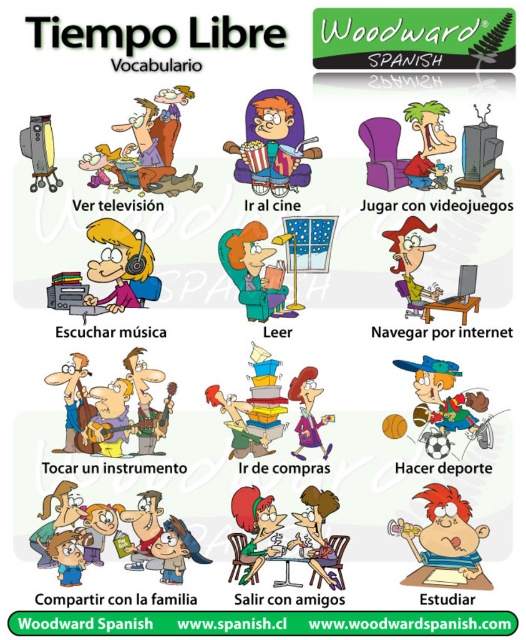
Question: Which point is farther to the camera?

Choices:
 (A) orange hair at center
 (B) matte green sweater at center
 (C) reddish-orange hair at lower right

Answer: (B)

Question: Observing the image, what is the correct spatial positioning of orange hair at center in reference to reddish-orange hair at lower right?

Choices:
 (A) left
 (B) right

Answer: (A)

Question: Does reddish-orange hair at lower right appear under matte purple dress at center?

Choices:
 (A) no
 (B) yes

Answer: (B)

Question: Is orange hair at center wider than matte green sweater at center?

Choices:
 (A) yes
 (B) no

Answer: (A)

Question: Among these objects, which one is farthest from the camera?

Choices:
 (A) matte green sweater at center
 (B) reddish-orange hair at lower right

Answer: (A)

Question: Among these objects, which one is farthest from the camera?

Choices:
 (A) orange hair at center
 (B) matte green sweater at center
 (C) matte purple dress at center

Answer: (B)